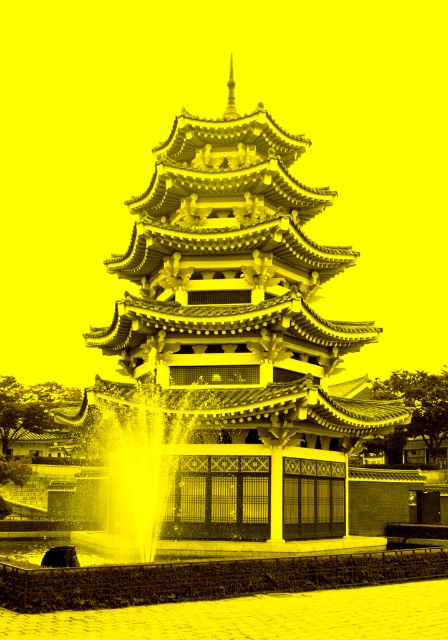
Question: Is yellowish-white stone pagoda at center closer to the viewer compared to translucent glass fountain at center?

Choices:
 (A) yes
 (B) no

Answer: (A)

Question: Which point is closer to the camera?

Choices:
 (A) yellowish-white stone pagoda at center
 (B) translucent glass fountain at center

Answer: (A)

Question: Does yellowish-white stone pagoda at center appear on the right side of translucent glass fountain at center?

Choices:
 (A) yes
 (B) no

Answer: (A)

Question: Which object appears farthest from the camera in this image?

Choices:
 (A) yellowish-white stone pagoda at center
 (B) translucent glass fountain at center

Answer: (B)

Question: Can you confirm if yellowish-white stone pagoda at center is positioned above translucent glass fountain at center?

Choices:
 (A) no
 (B) yes

Answer: (B)